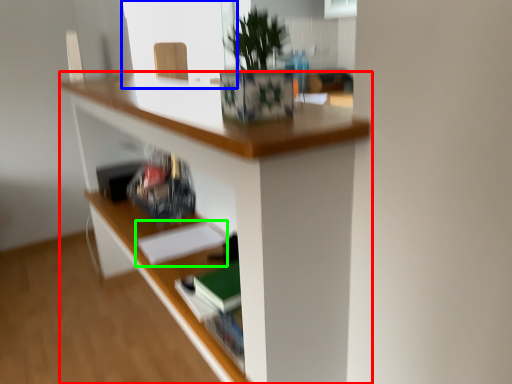
Question: Which object is positioned closest to desk (highlighted by a red box)? Select from window screen (highlighted by a blue box) and paperback book (highlighted by a green box).

Choices:
 (A) window screen
 (B) paperback book

Answer: (B)